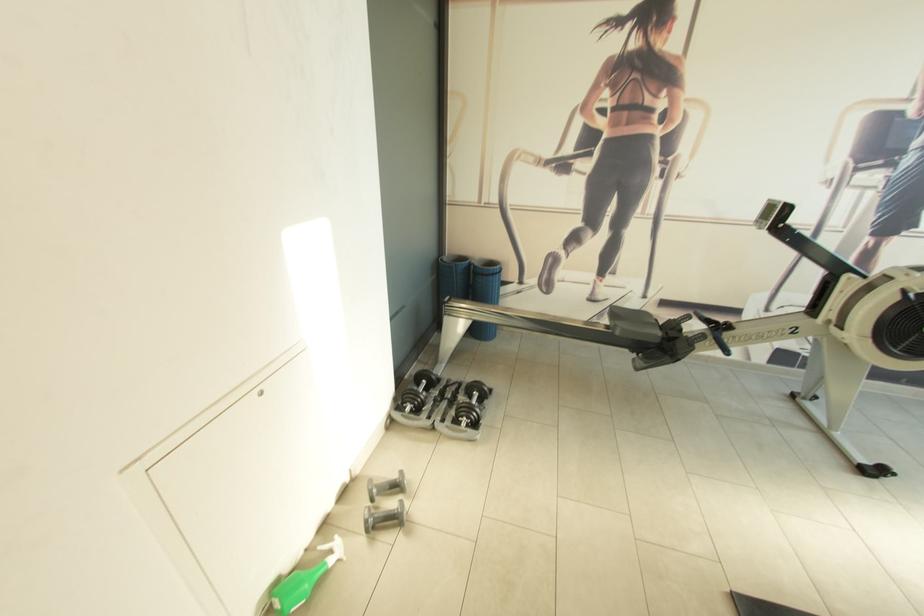
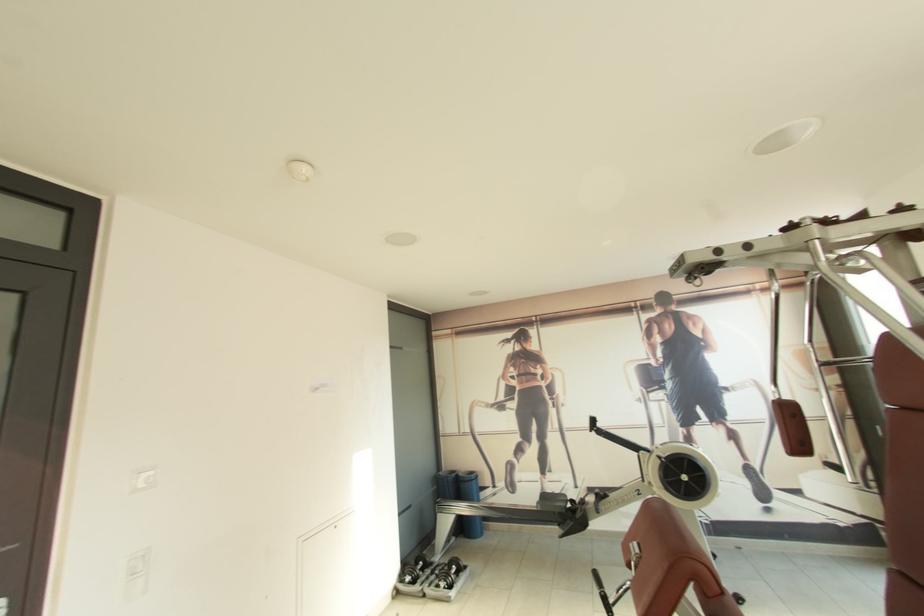
The point at (448, 406) is marked in the first image. Where is the corresponding point in the second image?

(436, 578)